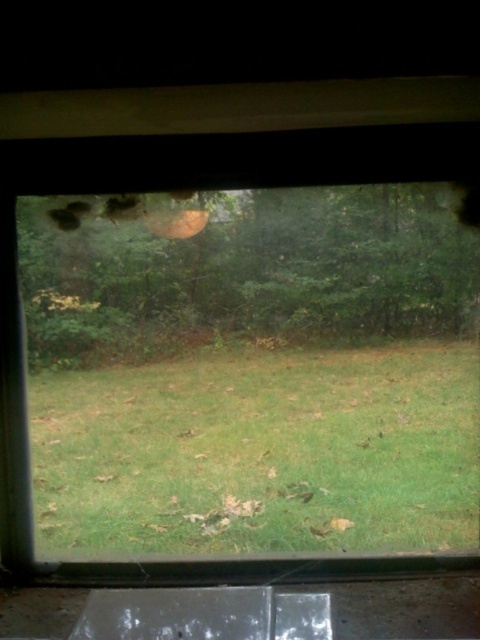
Which of these two, green grassy at center or green matte tree at center, stands taller?

With more height is green matte tree at center.

What do you see at coordinates (260, 451) in the screenshot?
I see `green grassy at center` at bounding box center [260, 451].

I want to click on green grassy at center, so click(x=260, y=451).